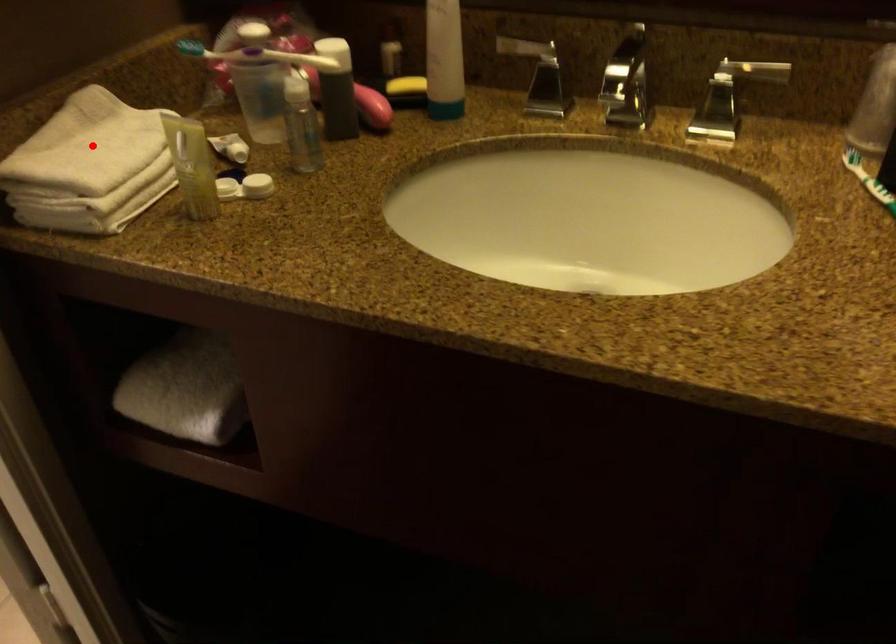
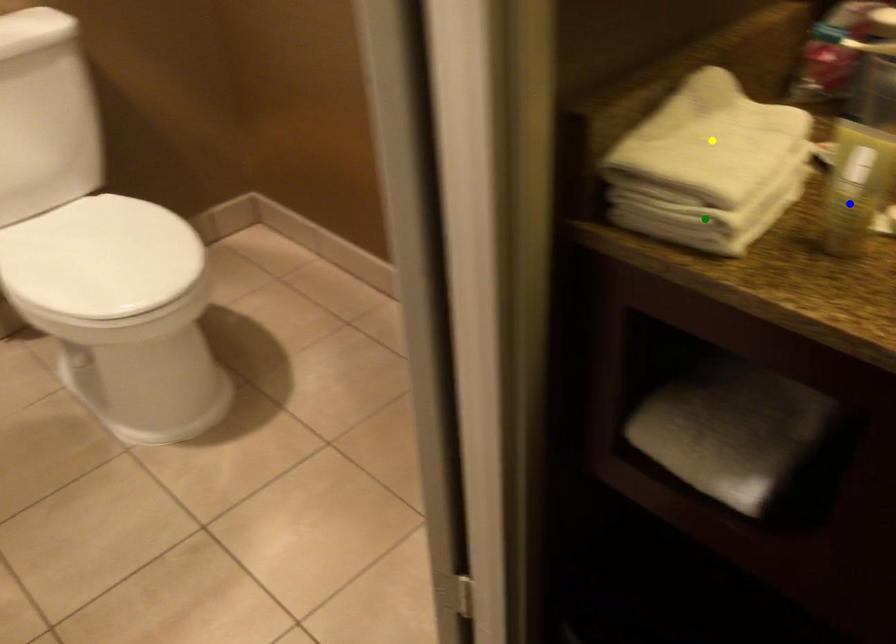
Question: I am providing you with two images of the same scene from different viewpoints. A red point is marked on the first image. You are given multiple points on the second image. Can you choose the point in image 2 that corresponds to the point in image 1?

Choices:
 (A) green point
 (B) blue point
 (C) yellow point

Answer: (C)